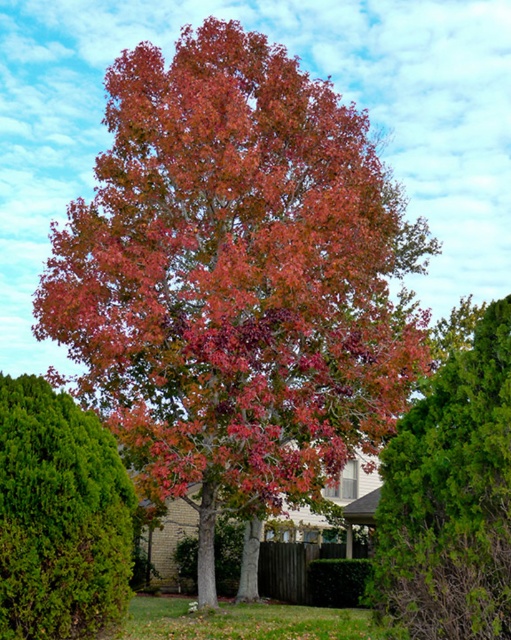
Question: Which object is farther from the camera taking this photo?

Choices:
 (A) green leafy hedge at lower center
 (B) green textured bush at lower left
 (C) green textured bush at right

Answer: (A)

Question: Does green textured bush at right appear on the left side of green leafy hedge at lower center?

Choices:
 (A) no
 (B) yes

Answer: (A)

Question: Is green textured bush at right further to the viewer compared to green leafy hedge at lower center?

Choices:
 (A) yes
 (B) no

Answer: (B)

Question: Estimate the real-world distances between objects in this image. Which object is farther from the green textured bush at right?

Choices:
 (A) green textured bush at lower left
 (B) green leafy hedge at lower center

Answer: (B)

Question: Which of the following is the closest to the observer?

Choices:
 (A) (26, 460)
 (B) (357, 582)

Answer: (A)

Question: Is green textured bush at right above green leafy hedge at lower center?

Choices:
 (A) yes
 (B) no

Answer: (A)